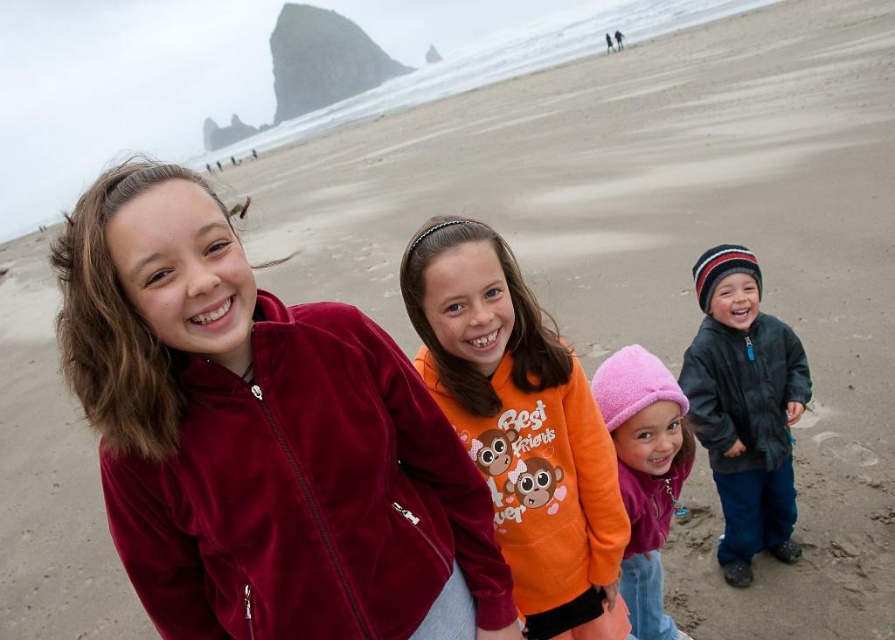
Between velvet maroon jacket at upper left and pink fleece hat at center, which one appears on the right side from the viewer's perspective?

From the viewer's perspective, pink fleece hat at center appears more on the right side.

Can you confirm if velvet maroon jacket at upper left is positioned to the right of pink fleece hat at center?

Incorrect, velvet maroon jacket at upper left is not on the right side of pink fleece hat at center.

Where is `velvet maroon jacket at upper left`? velvet maroon jacket at upper left is located at coordinates (258, 435).

Who is lower down, velvet maroon jacket at upper left or dark gray fleece jacket at lower right?

Positioned lower is velvet maroon jacket at upper left.

Between velvet maroon jacket at upper left and dark gray fleece jacket at lower right, which one has less height?

With less height is velvet maroon jacket at upper left.

The width and height of the screenshot is (895, 640). I want to click on velvet maroon jacket at upper left, so click(x=258, y=435).

Who is shorter, velvet maroon jacket at upper left or orange fleece sweatshirt at center?

velvet maroon jacket at upper left

At what (x,y) coordinates should I click in order to perform the action: click on velvet maroon jacket at upper left. Please return your answer as a coordinate pair (x, y). The width and height of the screenshot is (895, 640). Looking at the image, I should click on (258, 435).

Where is `velvet maroon jacket at upper left`? velvet maroon jacket at upper left is located at coordinates (258, 435).